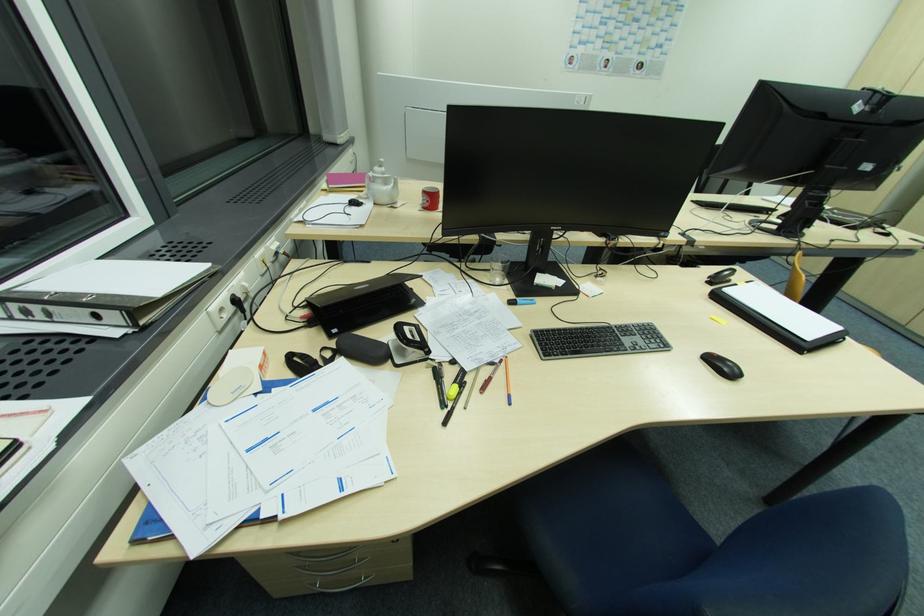
What are the coordinates of `small drinking glass` in the screenshot? It's located at (497, 270).